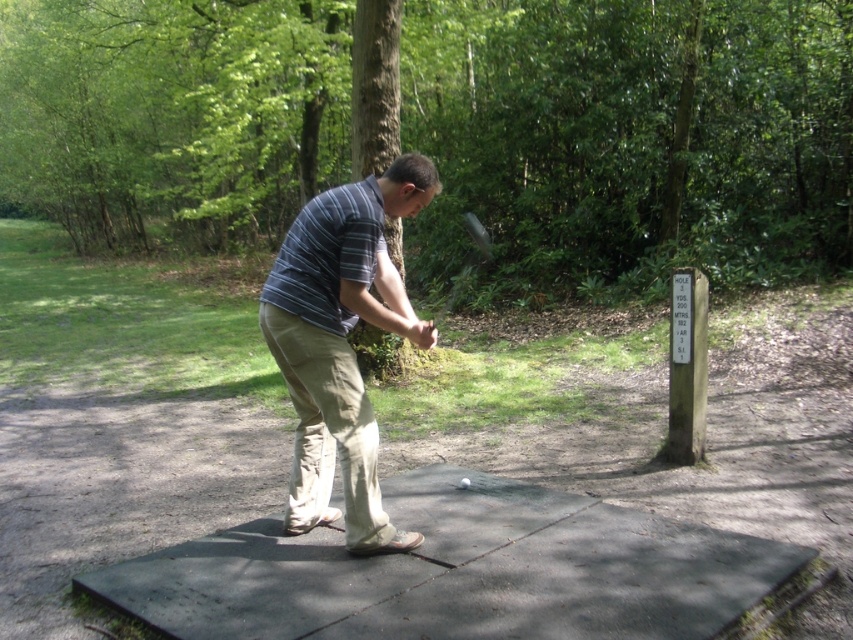
Is green rubber mat at center positioned in front of striped cotton shirt at center?

Yes, green rubber mat at center is in front of striped cotton shirt at center.

Locate an element on the screen. The image size is (853, 640). green rubber mat at center is located at coordinates (457, 572).

The height and width of the screenshot is (640, 853). In order to click on green rubber mat at center in this screenshot , I will do `click(457, 572)`.

Does green rubber mat at center appear under shiny black golf club at center?

Correct, green rubber mat at center is located below shiny black golf club at center.

Can you confirm if green rubber mat at center is taller than shiny black golf club at center?

In fact, green rubber mat at center may be shorter than shiny black golf club at center.

This screenshot has width=853, height=640. Identify the location of green rubber mat at center. (457, 572).

The width and height of the screenshot is (853, 640). What are the coordinates of `green rubber mat at center` in the screenshot? It's located at (457, 572).

I want to click on striped cotton shirt at center, so click(x=341, y=342).

Which is behind, point (302, 300) or point (436, 326)?

Positioned behind is point (436, 326).

Which is in front, point (354, 472) or point (467, 227)?

Positioned in front is point (354, 472).

The width and height of the screenshot is (853, 640). I want to click on striped cotton shirt at center, so coord(341,342).